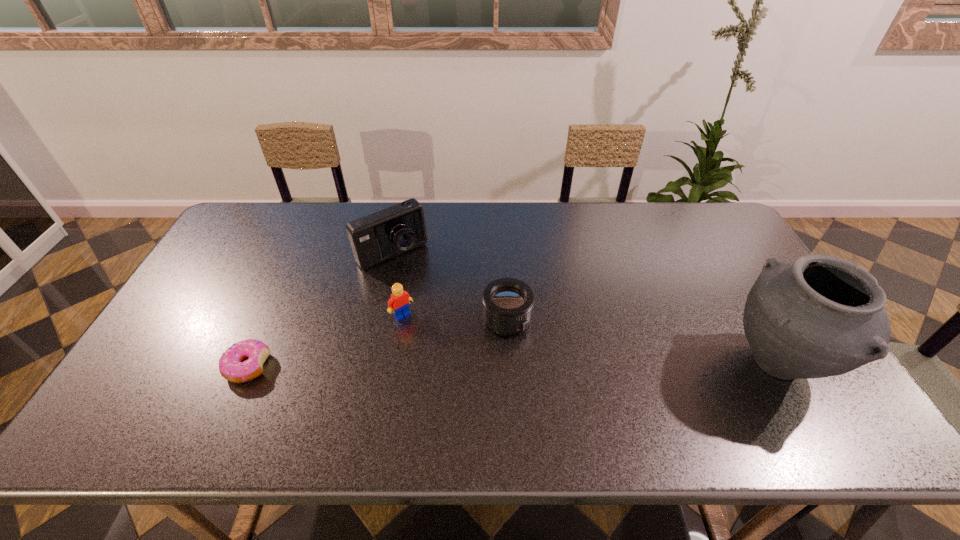
You are a GUI agent. You are given a task and a screenshot of the screen. Output one action in this format:
    pyautogui.click(x=<x>, y=<y>)
    Task: Click on the free space located 0.210m on the left of the rightmost object
    This screenshot has width=960, height=540.
    Given the screenshot: What is the action you would take?
    pyautogui.click(x=642, y=363)

The height and width of the screenshot is (540, 960). Identify the location of free spot located 0.280m on the front-facing side of the camera. (453, 327).

Find the location of a particular element. The image size is (960, 540). blank space located on the front-facing side of the camera is located at coordinates (431, 298).

Identify the location of vacant space located 0.370m on the front-facing side of the camera. This screenshot has width=960, height=540. (470, 349).

Image resolution: width=960 pixels, height=540 pixels. Find the location of `vacant region located on the side of the second object from right to left with brand markings and control switches`. vacant region located on the side of the second object from right to left with brand markings and control switches is located at coordinates (554, 349).

You are a GUI agent. You are given a task and a screenshot of the screen. Output one action in this format:
    pyautogui.click(x=<x>, y=<y>)
    Task: Click on the vacant space positioned 0.090m on the side of the second object from right to left with brand markings and control switches
    The height and width of the screenshot is (540, 960).
    Given the screenshot: What is the action you would take?
    pyautogui.click(x=554, y=349)

Where is `free region located 0.160m on the side of the second object from right to left with brand markings and control switches`? This screenshot has width=960, height=540. free region located 0.160m on the side of the second object from right to left with brand markings and control switches is located at coordinates (577, 364).

In order to click on vacant space situated 0.220m on the face of the third tallest object in this screenshot , I will do `click(456, 374)`.

Locate an element on the screen. This screenshot has width=960, height=540. vacant space positioned on the face of the third tallest object is located at coordinates (424, 339).

Find the location of `free space located 0.220m on the face of the third tallest object`. free space located 0.220m on the face of the third tallest object is located at coordinates (456, 374).